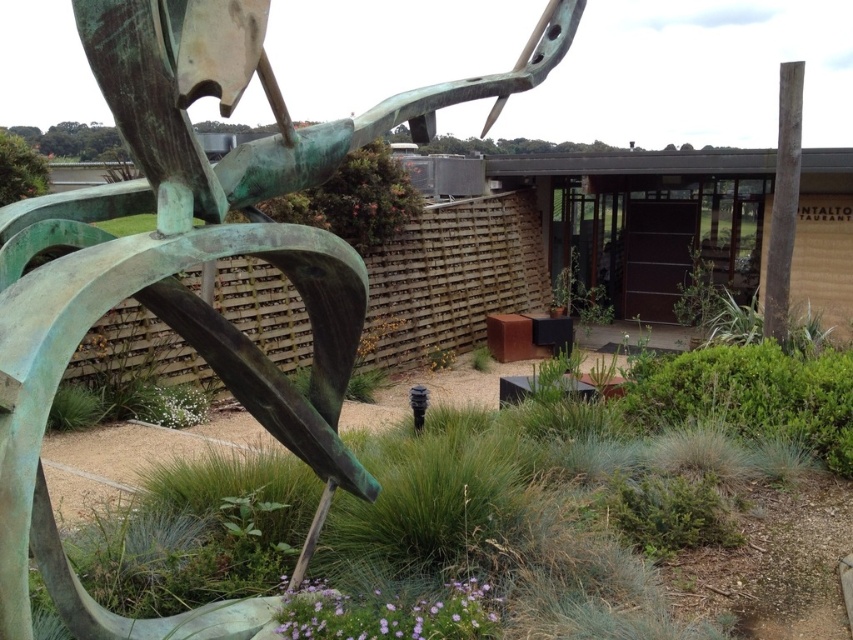
Between green patina metal sculpture at left and green patina sculpture at center-left, which one appears on the left side from the viewer's perspective?

green patina metal sculpture at left is more to the left.

Does point (207, 92) come behind point (363, 524)?

No, it is not.

Identify the location of green patina metal sculpture at left. (194, 262).

The image size is (853, 640). I want to click on green patina metal sculpture at left, so [x=194, y=262].